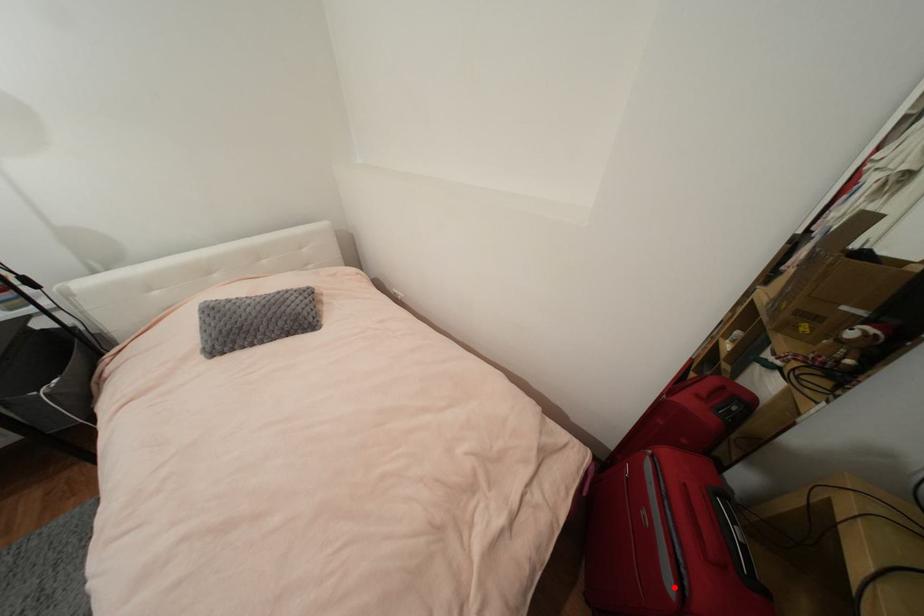
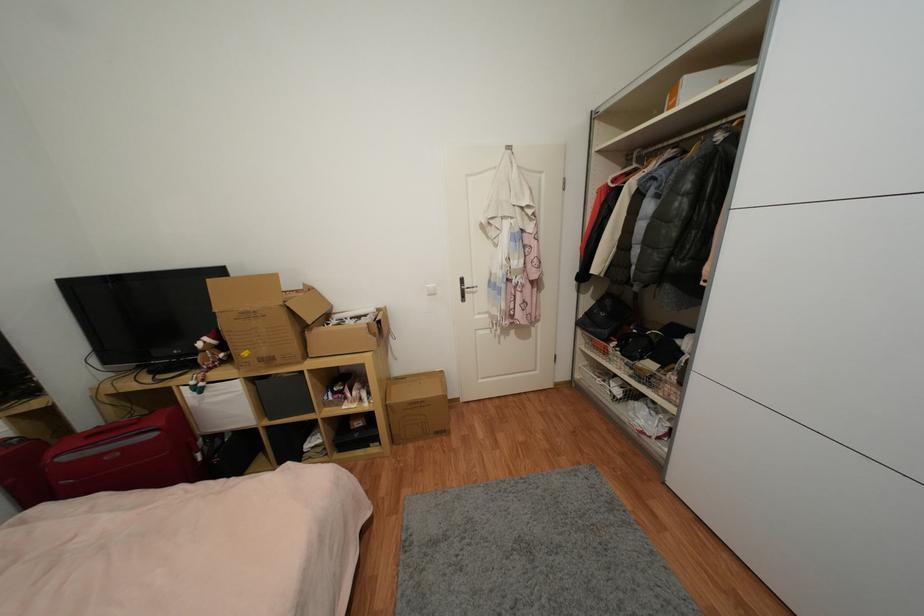
Where in the second image is the point corresponding to the highlighted location from the first image?

(157, 436)